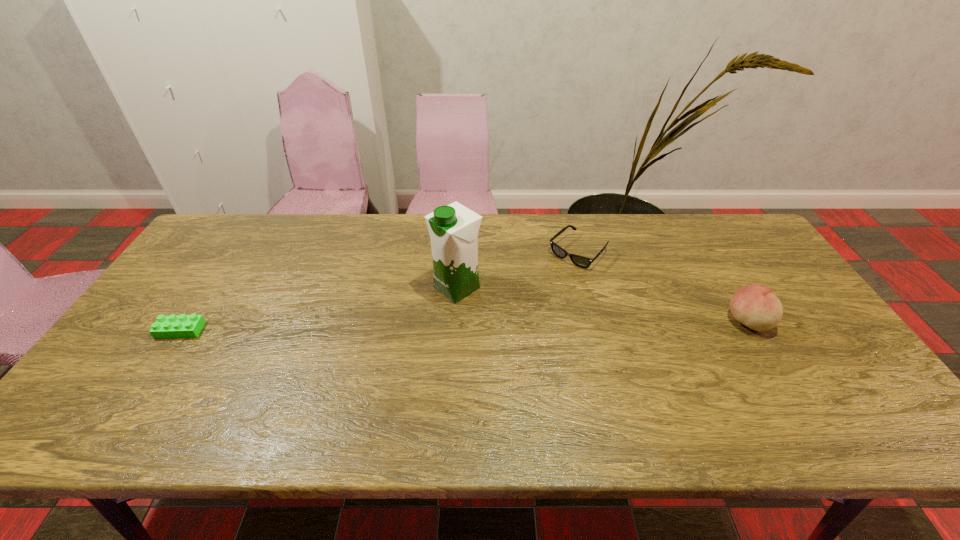
Locate an element on the screen. This screenshot has height=540, width=960. Lego is located at coordinates (173, 326).

The image size is (960, 540). In order to click on the shortest object in this screenshot , I will do `click(173, 326)`.

What are the coordinates of `the rightmost object` in the screenshot? It's located at click(x=756, y=306).

Find the location of a particular element. This screenshot has height=540, width=960. the third shortest object is located at coordinates (756, 306).

The width and height of the screenshot is (960, 540). What are the coordinates of `the second object from right to left` in the screenshot? It's located at tap(580, 261).

Where is `the third tallest object`? The image size is (960, 540). the third tallest object is located at coordinates (580, 261).

Find the location of a particular element. The image size is (960, 540). the third object from right to left is located at coordinates (453, 229).

Locate an element on the screen. This screenshot has width=960, height=540. the tallest object is located at coordinates (453, 229).

What are the coordinates of `vacant space located on the back of the leftmost object` in the screenshot? It's located at (238, 243).

Image resolution: width=960 pixels, height=540 pixels. Identify the location of free space located 0.150m on the back of the rightmost object. (716, 270).